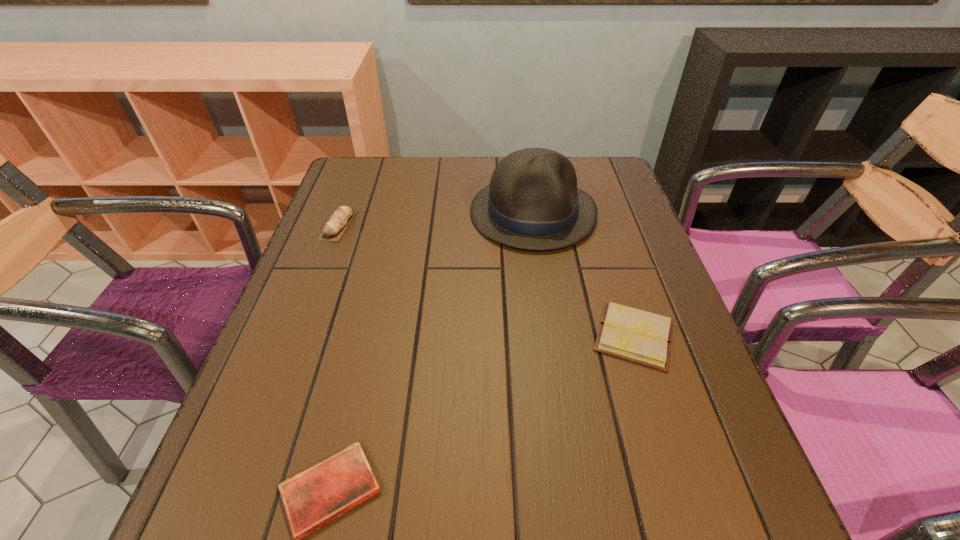
Find the location of `unoccupied area between the right diary and the bowler hat`. unoccupied area between the right diary and the bowler hat is located at coordinates (584, 274).

Identify the location of vacant region between the second nearest object and the pita bread. (487, 280).

Identify the location of free area in between the tallest object and the third farthest object. (584, 274).

At what (x,y) coordinates should I click in order to perform the action: click on object that is the second closest to the right diary. Please return your answer as a coordinate pair (x, y). This screenshot has width=960, height=540. Looking at the image, I should click on click(x=314, y=497).

Locate an element on the screen. object that is the third closest one to the taller diary is located at coordinates (333, 230).

The image size is (960, 540). Identify the location of vacant area in the image that satisfies the following two spatial constraints: 1. on the front-facing side of the taller diary; 2. on the right side of the bowler hat. (551, 335).